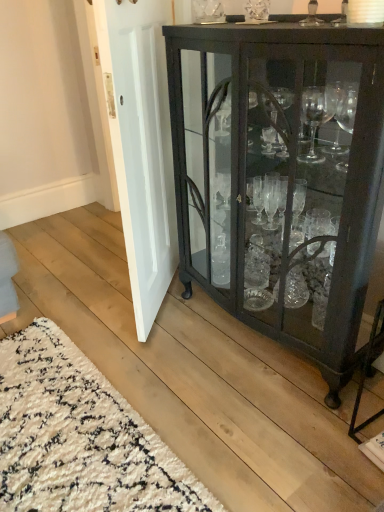
Image resolution: width=384 pixels, height=512 pixels. I want to click on free space to the left of white painted wood door at center, so click(x=82, y=290).